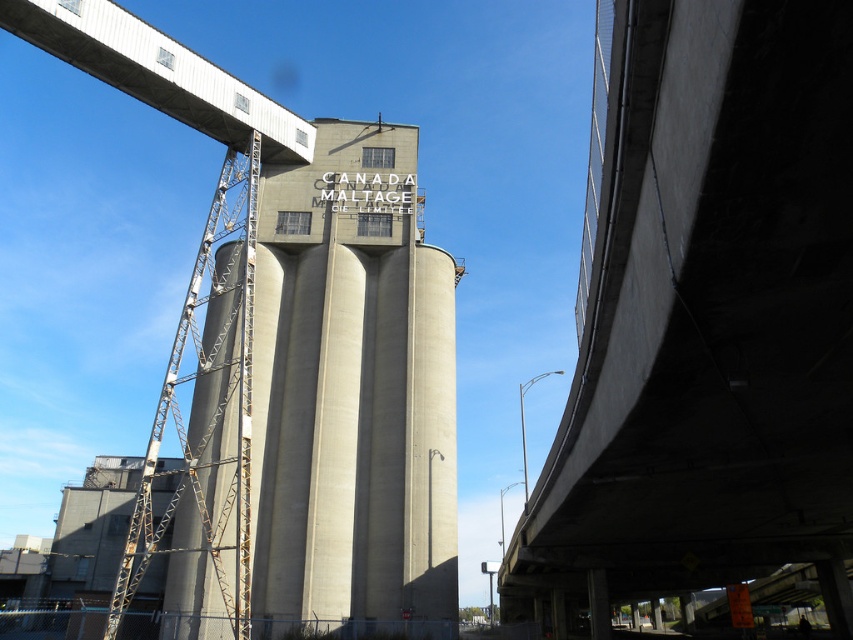
From the picture: Is concrete bridge at upper right smaller than metallic gray bridge at upper left?

Actually, concrete bridge at upper right might be larger than metallic gray bridge at upper left.

Measure the distance from concrete bridge at upper right to metallic gray bridge at upper left.

43.89 meters

What do you see at coordinates (703, 312) in the screenshot?
I see `concrete bridge at upper right` at bounding box center [703, 312].

What are the coordinates of `concrete bridge at upper right` in the screenshot? It's located at (703, 312).

Does concrete bridge at upper right have a lesser height compared to concrete silo at center?

In fact, concrete bridge at upper right may be taller than concrete silo at center.

Between concrete bridge at upper right and concrete silo at center, which one appears on the left side from the viewer's perspective?

concrete silo at center

Image resolution: width=853 pixels, height=640 pixels. What are the coordinates of `concrete bridge at upper right` in the screenshot? It's located at (703, 312).

Who is positioned more to the right, concrete silo at center or metallic gray bridge at upper left?

Positioned to the right is concrete silo at center.

Which is above, concrete silo at center or metallic gray bridge at upper left?

Positioned higher is metallic gray bridge at upper left.

Who is more distant from viewer, (399, 282) or (212, 70)?

The point (399, 282) is more distant.

Find the location of a particular element. The width and height of the screenshot is (853, 640). concrete silo at center is located at coordinates (352, 388).